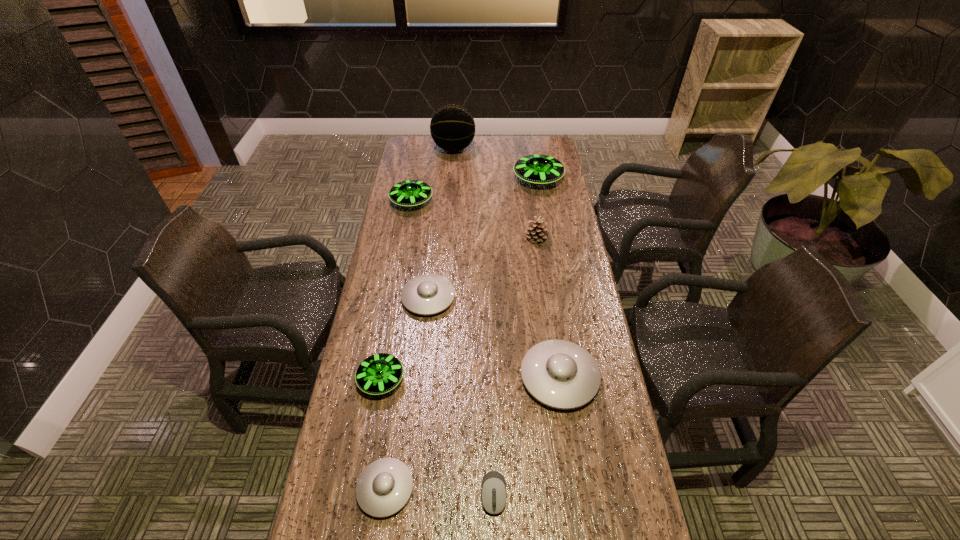
The height and width of the screenshot is (540, 960). I want to click on free region located on the left of the biggest gray saucer, so click(x=424, y=377).

Locate an element on the screen. The width and height of the screenshot is (960, 540). free space located on the right of the nearest green saucer is located at coordinates (474, 380).

This screenshot has height=540, width=960. I want to click on free space located on the back of the farthest gray saucer, so tap(432, 261).

Find the location of a particular element. This screenshot has height=540, width=960. free space located on the left of the nearest gray saucer is located at coordinates (328, 489).

Where is `object positioned at the far edge`? object positioned at the far edge is located at coordinates (452, 127).

At what (x,y) coordinates should I click in order to perform the action: click on basketball that is at the left edge. Please return your answer as a coordinate pair (x, y). Looking at the image, I should click on click(452, 127).

Where is `pinecone that is at the right edge`? The image size is (960, 540). pinecone that is at the right edge is located at coordinates (538, 231).

You are a GUI agent. You are given a task and a screenshot of the screen. Output one action in this format:
    pyautogui.click(x=<x>, y=<y>)
    Task: Click on the object that is positioned at the far left corner
    This screenshot has height=540, width=960.
    Given the screenshot: What is the action you would take?
    pyautogui.click(x=452, y=127)

The height and width of the screenshot is (540, 960). I want to click on free region at the far edge, so click(503, 157).

Locate an element on the screen. vacant region at the left edge is located at coordinates (391, 312).